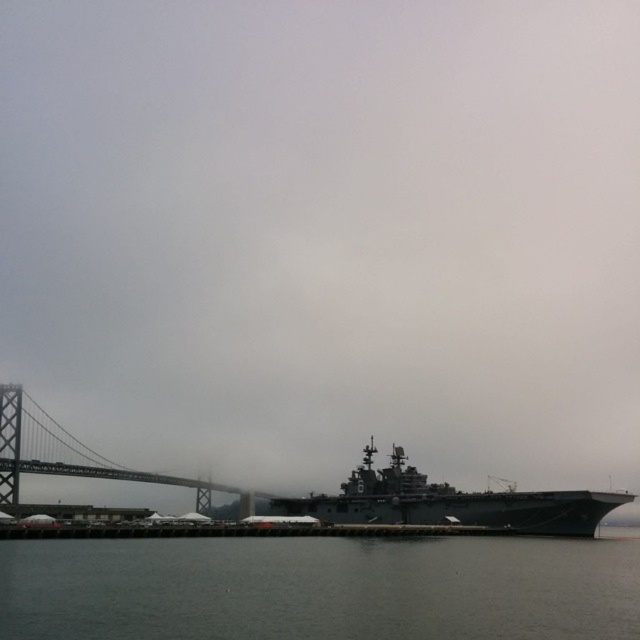
Question: Does dark gray metallic aircraft carrier at center appear over gray metallic bridge at left?

Choices:
 (A) yes
 (B) no

Answer: (A)

Question: Which of the following is the farthest from the observer?

Choices:
 (A) gray metallic bridge at left
 (B) dark gray water at lower center
 (C) dark gray metallic aircraft carrier at center

Answer: (A)

Question: Which point is farther to the camera?

Choices:
 (A) (40, 412)
 (B) (451, 499)

Answer: (A)

Question: Considering the relative positions of dark gray metallic aircraft carrier at center and gray metallic bridge at left in the image provided, where is dark gray metallic aircraft carrier at center located with respect to gray metallic bridge at left?

Choices:
 (A) below
 (B) above

Answer: (B)

Question: Is dark gray metallic aircraft carrier at center below gray metallic bridge at left?

Choices:
 (A) yes
 (B) no

Answer: (B)

Question: Which object is farther from the camera taking this photo?

Choices:
 (A) dark gray metallic aircraft carrier at center
 (B) dark gray water at lower center
 (C) gray metallic bridge at left

Answer: (C)